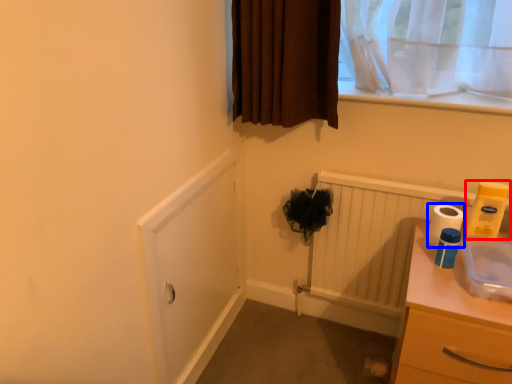
Question: Which object is further to the camera taking this photo, toilet paper (highlighted by a red box) or toilet paper (highlighted by a blue box)?

Choices:
 (A) toilet paper
 (B) toilet paper

Answer: (B)